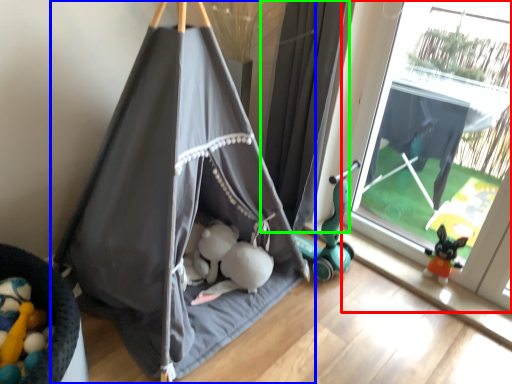
Question: Estimate the real-world distances between objects in this image. Which object is closer to window (highlighted by a red box), tent (highlighted by a blue box) or curtain (highlighted by a green box)?

Choices:
 (A) tent
 (B) curtain

Answer: (B)